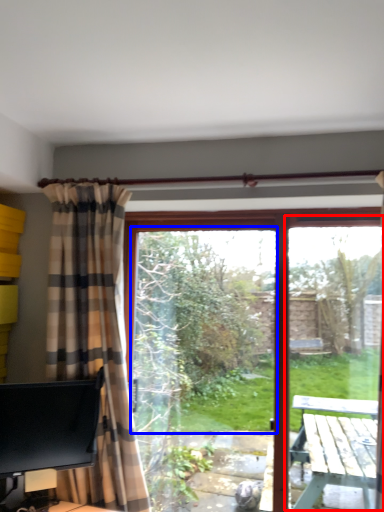
Question: Which of the following is the farthest to the observer, screen door (highlighted by a red box) or window screen (highlighted by a blue box)?

Choices:
 (A) screen door
 (B) window screen

Answer: (B)